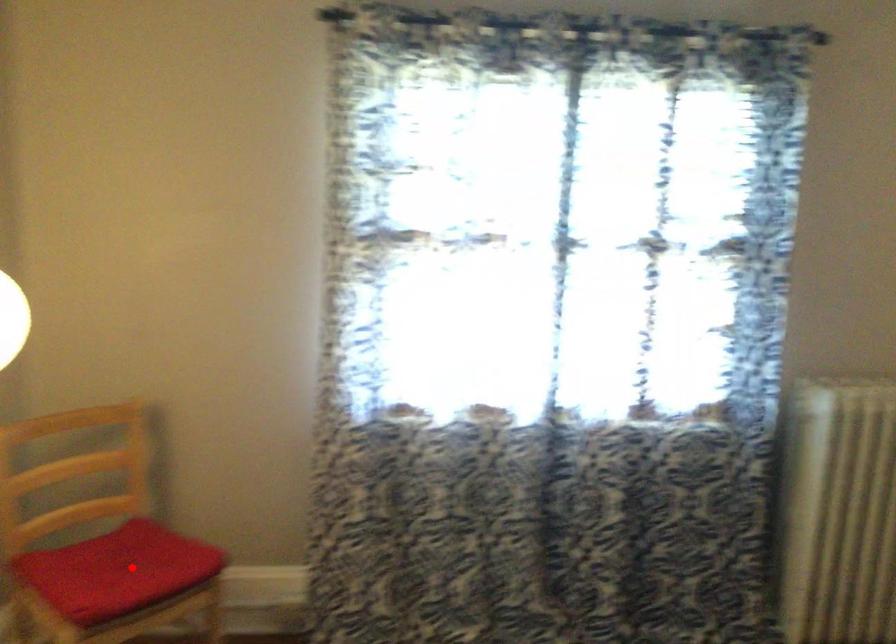
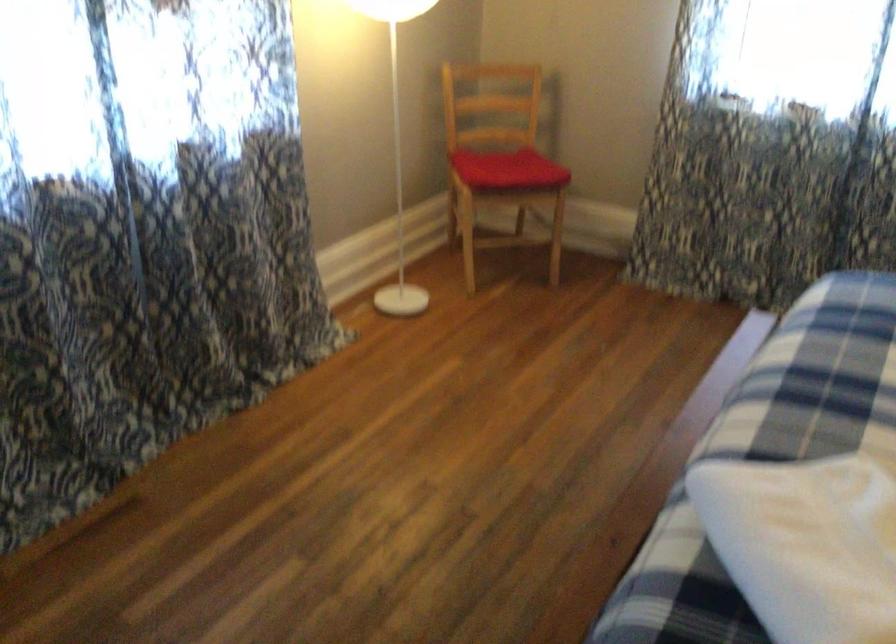
The point at the highlighted location is marked in the first image. Where is the corresponding point in the second image?

(507, 169)